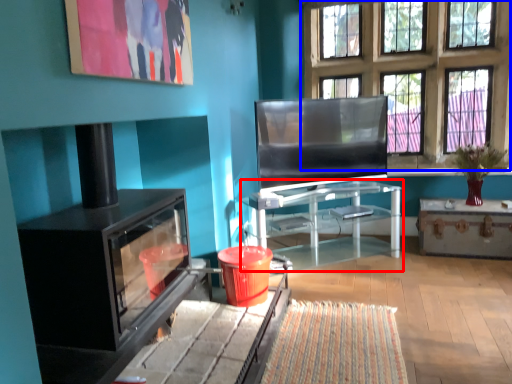
Question: Which of the following is the farthest to the observer, table (highlighted by a red box) or window (highlighted by a blue box)?

Choices:
 (A) table
 (B) window

Answer: (B)